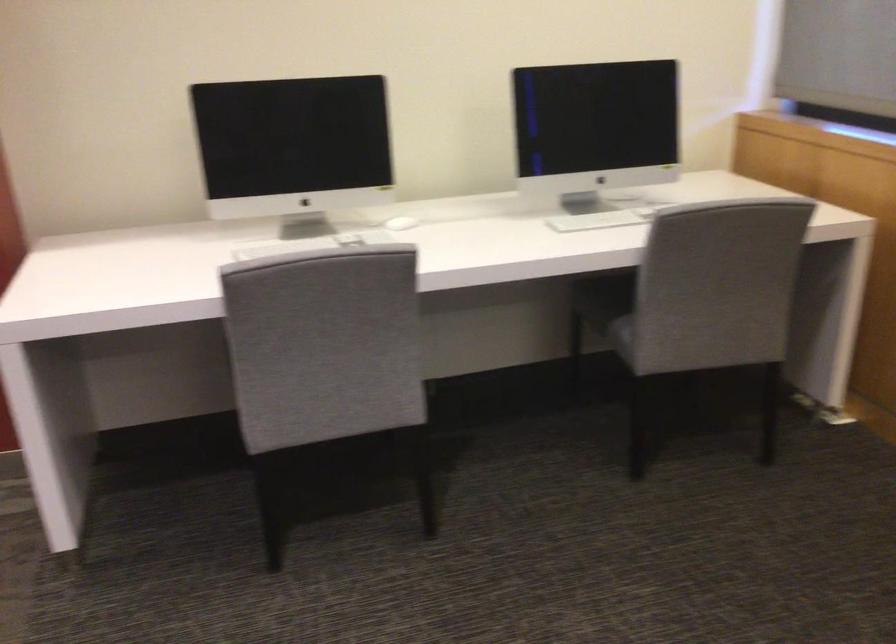
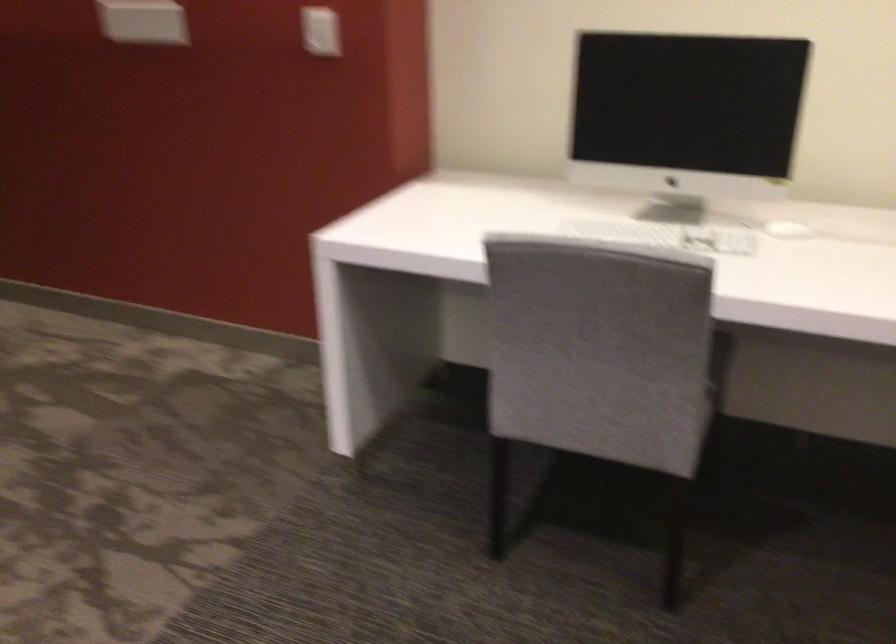
Question: The images are taken continuously from a first-person perspective. In which direction is your viewpoint rotating?

Choices:
 (A) Left
 (B) Right
 (C) Up
 (D) Down

Answer: (A)